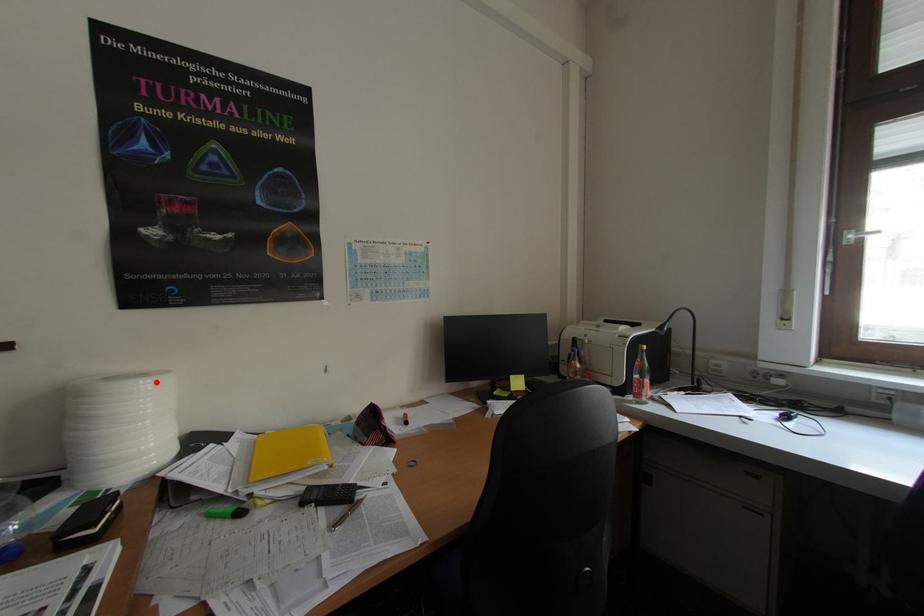
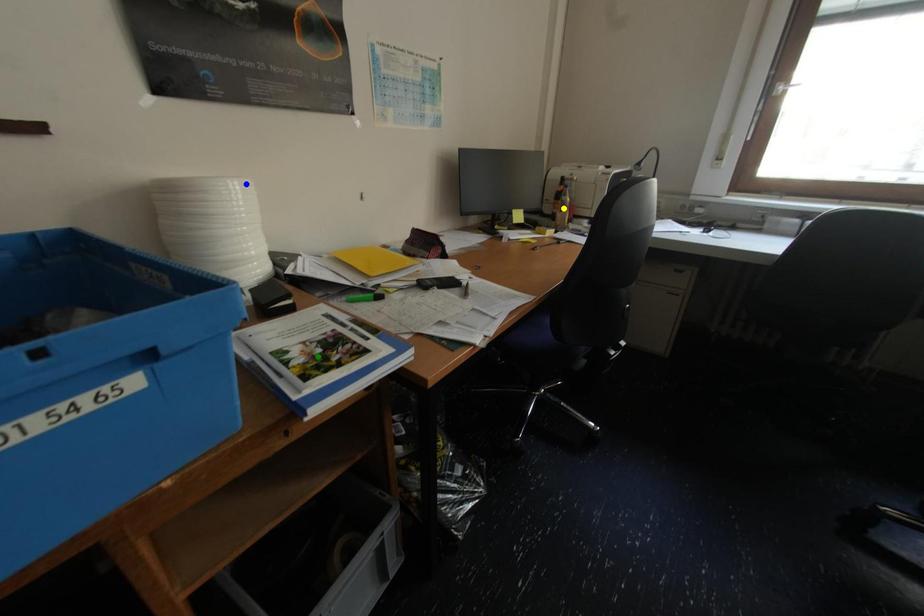
Question: I am providing you with two images of the same scene from different viewpoints. A red point is marked on the first image. You are given multiple points on the second image. Can you choose the point in image 2 that corresponds to the point in image 1?

Choices:
 (A) green point
 (B) blue point
 (C) yellow point

Answer: (B)